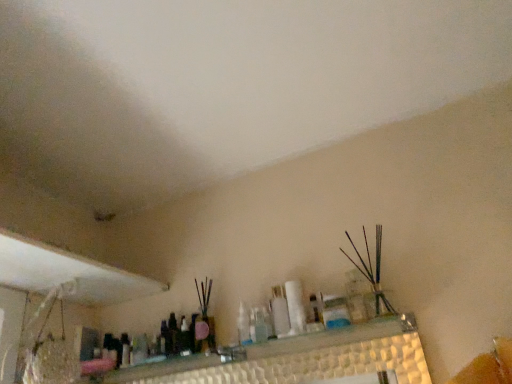
Identify the location of empty space that is ontop of translucent glass counter at lower center. Image resolution: width=512 pixels, height=384 pixels. (211, 349).